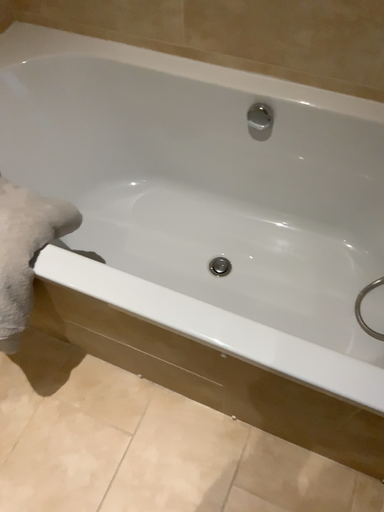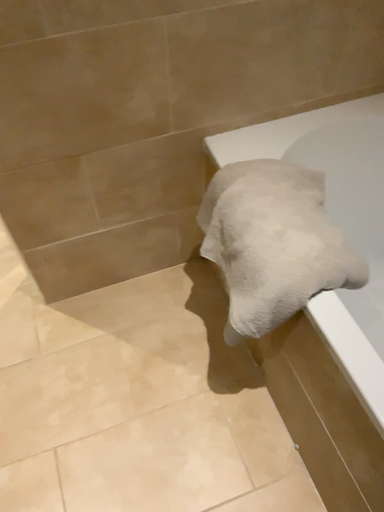
Question: How did the camera likely rotate when shooting the video?

Choices:
 (A) rotated upward
 (B) rotated downward

Answer: (A)